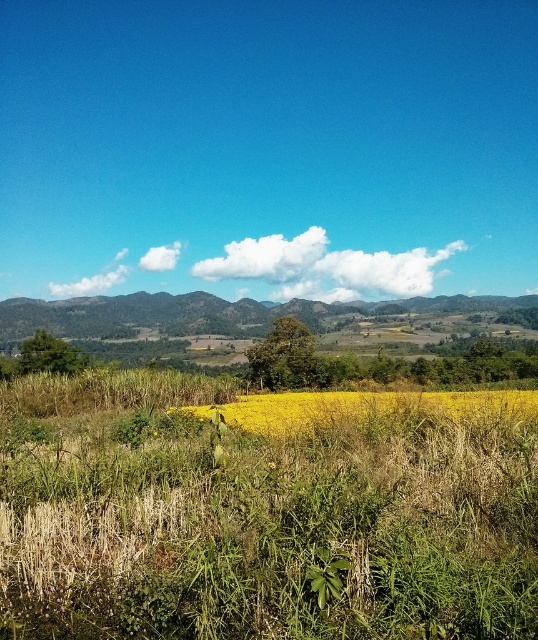
Question: Which is nearer to the yellow grass at center?

Choices:
 (A) white fluffy cloud at upper center
 (B) green leafy weed at center

Answer: (B)

Question: From the image, what is the correct spatial relationship of white fluffy cloud at upper center in relation to yellow grass at center?

Choices:
 (A) below
 (B) above

Answer: (B)

Question: Which point is closer to the camera taking this photo?

Choices:
 (A) (247, 272)
 (B) (449, 410)

Answer: (B)

Question: Which is nearer to the green leafy weed at center?

Choices:
 (A) white fluffy cloud at upper center
 (B) yellow grass at center

Answer: (B)

Question: Is yellow grass at center to the right of green leafy weed at center from the viewer's perspective?

Choices:
 (A) no
 (B) yes

Answer: (B)

Question: Is the position of white fluffy cloud at upper center less distant than that of yellow grass at center?

Choices:
 (A) yes
 (B) no

Answer: (B)